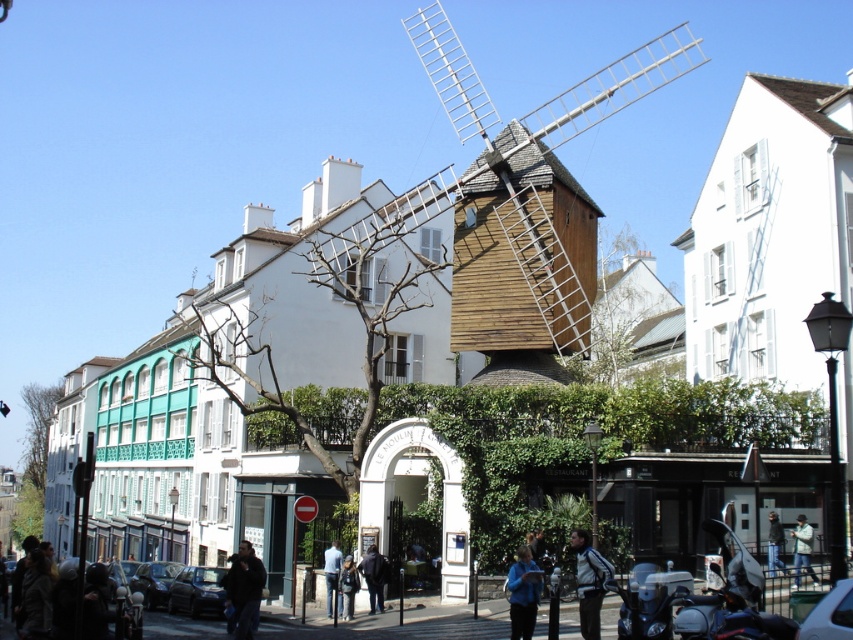
Which is above, shiny black motorcycle at lower right or metallic blue motorcycle at center?

Positioned higher is shiny black motorcycle at lower right.

Can you confirm if shiny black motorcycle at lower right is taller than metallic blue motorcycle at center?

Yes, shiny black motorcycle at lower right is taller than metallic blue motorcycle at center.

Locate an element on the screen. shiny black motorcycle at lower right is located at coordinates (730, 596).

Is dark blue jacket at lower left positioned in front of blue shirt at center?

That is True.

Which is in front, point (247, 554) or point (332, 611)?

Point (247, 554) is in front.

Between point (239, 600) and point (326, 593), which one is positioned behind?

Point (326, 593)

The image size is (853, 640). I want to click on dark blue jacket at lower left, so click(x=244, y=589).

Does dark blue jacket at lower left have a larger size compared to blue fabric jacket at lower center?

Yes.

Which is behind, point (238, 564) or point (521, 584)?

The point (238, 564) is more distant.

Does point (264, 579) come closer to viewer compared to point (531, 612)?

That is False.

You are a GUI agent. You are given a task and a screenshot of the screen. Output one action in this format:
    pyautogui.click(x=<x>, y=<y>)
    Task: Click on the dark blue jacket at lower left
    The height and width of the screenshot is (640, 853).
    Given the screenshot: What is the action you would take?
    pyautogui.click(x=244, y=589)